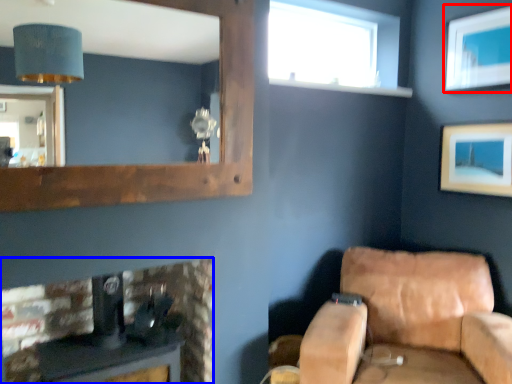
Question: Which point is closer to the camera, picture frame (highlighted by a red box) or furniture (highlighted by a blue box)?

Choices:
 (A) picture frame
 (B) furniture

Answer: (B)